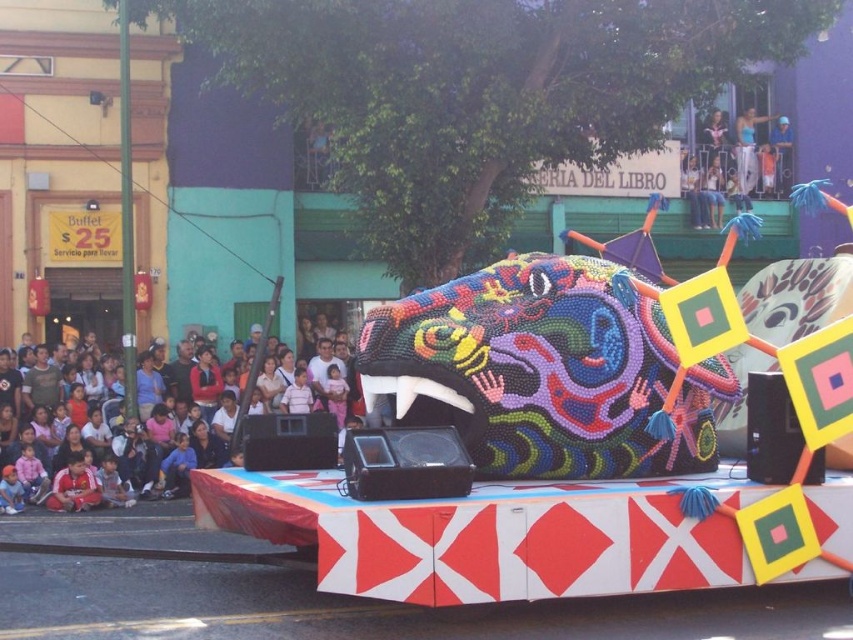
You are a photographer trying to capture the parade float and the crowd. You notice a point at coordinates point (747, 148). Based on the scene description, can you determine what object this point is located on?

The point (747, 148) is located on the white fabric pants at upper right.

You are a photographer standing at the back of the crowd. You want to capture a photo of the multicolored beaded sculpture at center without the multicolored fabric crowd at lower left blocking the view. Is there enough space between them for you to take the photo?

The multicolored beaded sculpture at center might be wider than the multicolored fabric crowd at lower left, so there may not be enough space between them to avoid the crowd blocking the view. You might need to move to a different angle or position to ensure the sculpture is fully visible.

You are standing at the center of the street and want to take a photo of the multicolored beaded sculpture at center. Based on its position, which direction should you face to ensure it is in the center of your camera view?

The multicolored beaded sculpture at center is located at point coordinates, so facing directly ahead should center it in your view.